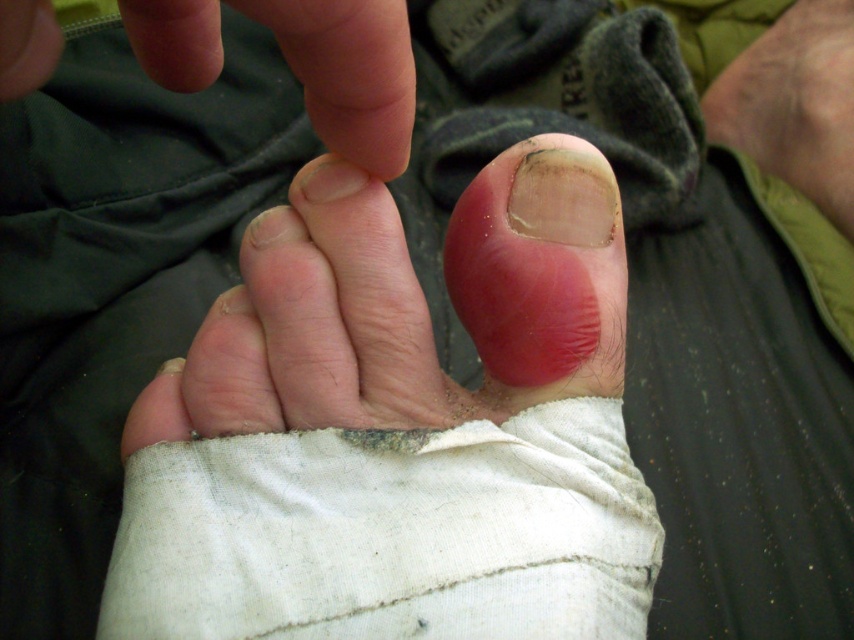
What do you see at coordinates (542, 268) in the screenshot? Image resolution: width=854 pixels, height=640 pixels. I see `pink flesh-toned nail at center` at bounding box center [542, 268].

Is pink flesh-toned nail at center wider than dry skin at upper right?

No, pink flesh-toned nail at center is not wider than dry skin at upper right.

Does point (525, 234) come in front of point (798, 147)?

Yes, it is in front of point (798, 147).

In order to click on pink flesh-toned nail at center in this screenshot , I will do `click(542, 268)`.

Can you confirm if pink flesh-toned toe at center is bigger than dry skin at upper right?

Actually, pink flesh-toned toe at center might be smaller than dry skin at upper right.

Who is more forward, (354, 257) or (793, 97)?

Positioned in front is point (354, 257).

Is point (334, 177) behind point (771, 112)?

No, (334, 177) is in front of (771, 112).

Find the location of a particular element. The height and width of the screenshot is (640, 854). pink flesh-toned toe at center is located at coordinates (407, 305).

Measure the distance from pink flesh-toned toe at center to pink flesh-toned nail at center.

They are 1.10 inches apart.

Does pink flesh-toned toe at center appear over pink flesh-toned nail at center?

Actually, pink flesh-toned toe at center is below pink flesh-toned nail at center.

What are the coordinates of `pink flesh-toned toe at center` in the screenshot? It's located at (407, 305).